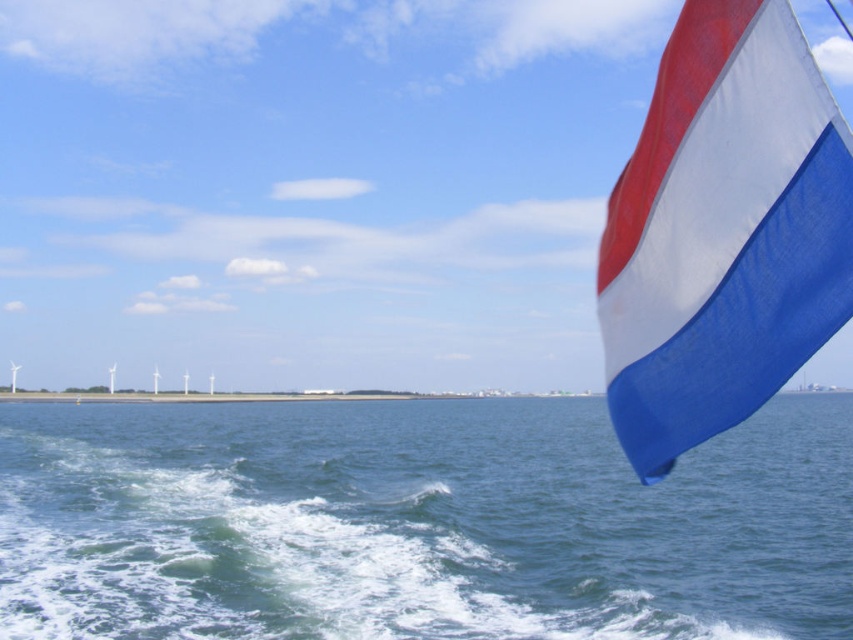
Question: From the image, what is the correct spatial relationship of blue water at lower right in relation to textured fabric flag at upper right?

Choices:
 (A) right
 (B) left

Answer: (A)

Question: Which point is closer to the camera taking this photo?

Choices:
 (A) (265, 429)
 (B) (647, 132)

Answer: (B)

Question: Does blue water at lower right have a smaller size compared to textured fabric flag at upper right?

Choices:
 (A) yes
 (B) no

Answer: (B)

Question: Which point is closer to the camera?

Choices:
 (A) (776, 140)
 (B) (335, 557)

Answer: (A)

Question: Can you confirm if blue water at lower right is positioned to the left of textured fabric flag at upper right?

Choices:
 (A) no
 (B) yes

Answer: (A)

Question: Which point is closer to the camera?

Choices:
 (A) textured fabric flag at upper right
 (B) blue water at lower right

Answer: (A)